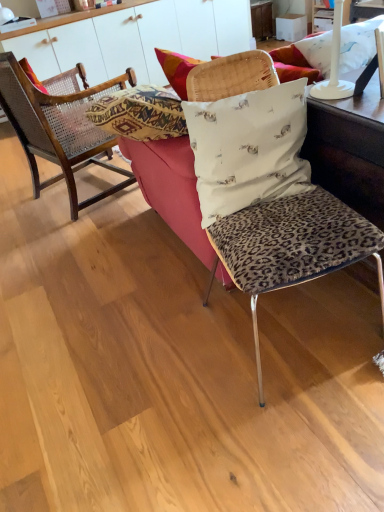
The width and height of the screenshot is (384, 512). What are the coordinates of `vacant space in leopard print cushion at center, acting as the 2th chair starting from the back (from a real-world perspective)` in the screenshot? It's located at (289, 329).